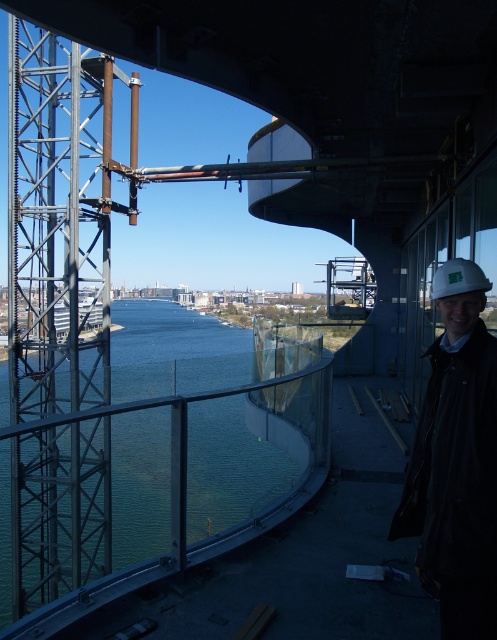
Question: Can you confirm if clear glass water at center is smaller than white hard hat at right?

Choices:
 (A) yes
 (B) no

Answer: (B)

Question: Can you confirm if clear glass water at center is wider than white hard hat at right?

Choices:
 (A) no
 (B) yes

Answer: (B)

Question: Which point appears closest to the camera in this image?

Choices:
 (A) (460, 541)
 (B) (129, 376)

Answer: (A)

Question: Does clear glass water at center have a larger size compared to white hard hat at right?

Choices:
 (A) yes
 (B) no

Answer: (A)